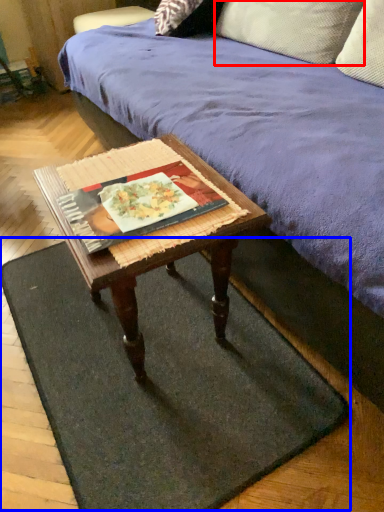
Question: Which point is closer to the camera, pillow (highlighted by a red box) or doormat (highlighted by a blue box)?

Choices:
 (A) pillow
 (B) doormat

Answer: (B)